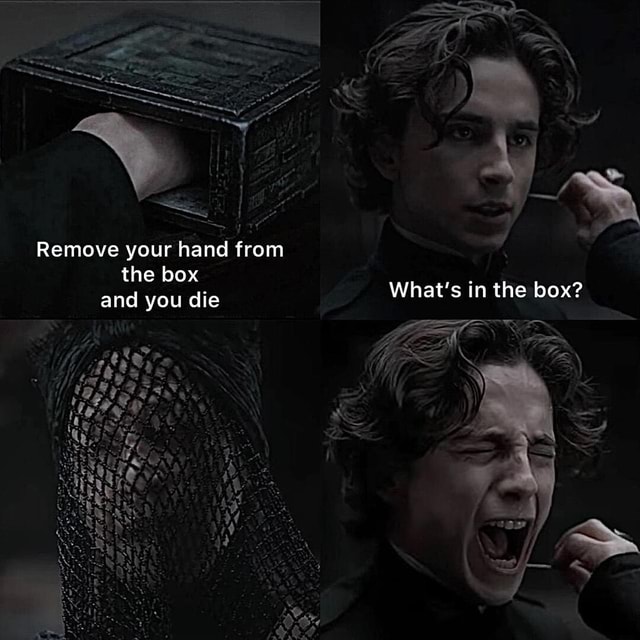
The height and width of the screenshot is (640, 640). What are the coordinates of `box` in the screenshot? It's located at (239, 91).